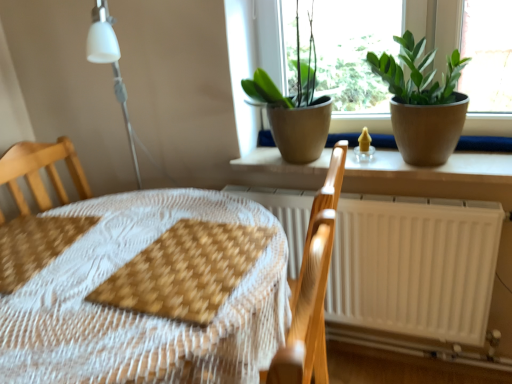
At what (x,y) coordinates should I click in order to perform the action: click on free space to the right of brown woven placemat at lower left, arranged as the 2th sheet when viewed from the right. Please return your answer as a coordinate pair (x, y). The width and height of the screenshot is (512, 384). Looking at the image, I should click on (120, 235).